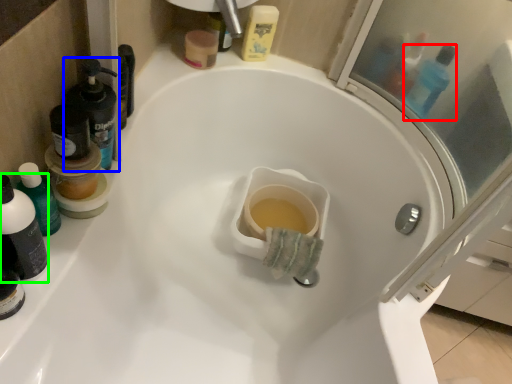
Question: Which is nearer to the mouthwash (highlighted by a red box)? mouthwash (highlighted by a blue box) or mouthwash (highlighted by a green box).

Choices:
 (A) mouthwash
 (B) mouthwash

Answer: (A)